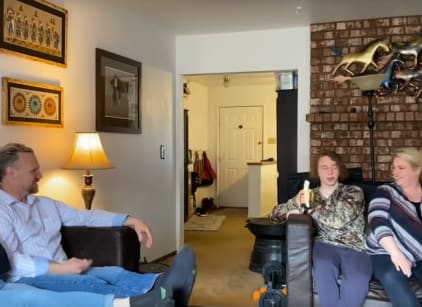
Where is `brick fireplace`? brick fireplace is located at coordinates (349, 131), (403, 127), (329, 30).